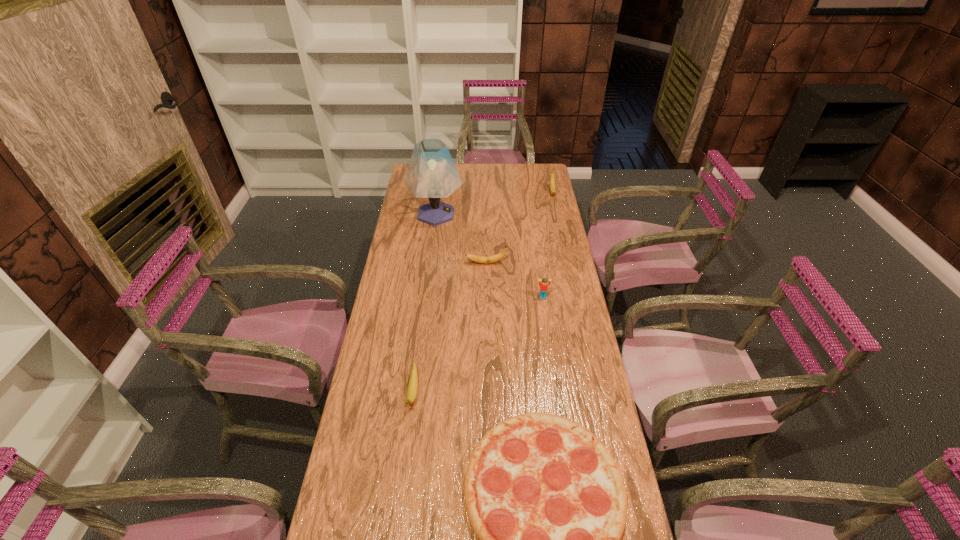
Identify the location of Lego located in the right edge section of the desktop. This screenshot has width=960, height=540. (544, 284).

Where is `object that is at the far right corner`? This screenshot has height=540, width=960. object that is at the far right corner is located at coordinates (552, 177).

Where is `free region at the left edge of the desktop`? free region at the left edge of the desktop is located at coordinates (397, 243).

In the image, there is a desktop. Where is `vacant space at the right edge`? This screenshot has height=540, width=960. vacant space at the right edge is located at coordinates (542, 304).

In the image, there is a desktop. Where is `free space at the far right corner`? free space at the far right corner is located at coordinates (531, 179).

The height and width of the screenshot is (540, 960). I want to click on vacant area that lies between the second farthest object and the second tallest object, so click(x=494, y=203).

The width and height of the screenshot is (960, 540). I want to click on free area in between the lampshade and the farthest object, so click(494, 203).

The height and width of the screenshot is (540, 960). I want to click on free space between the Lego and the lampshade, so click(490, 255).

Identify the location of blank region between the tallest object and the Lego. (490, 255).

I want to click on vacant space that's between the Lego and the shortest banana, so tap(478, 345).